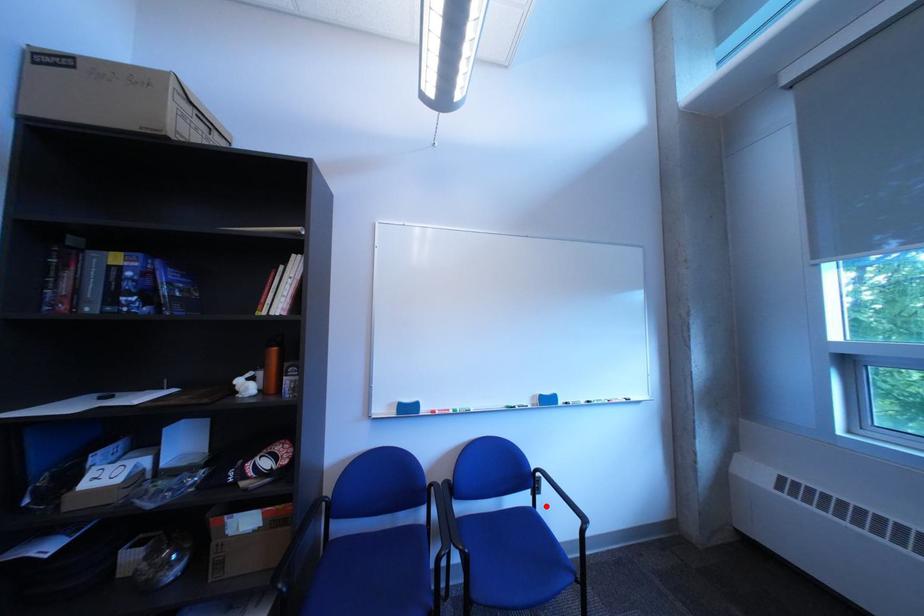
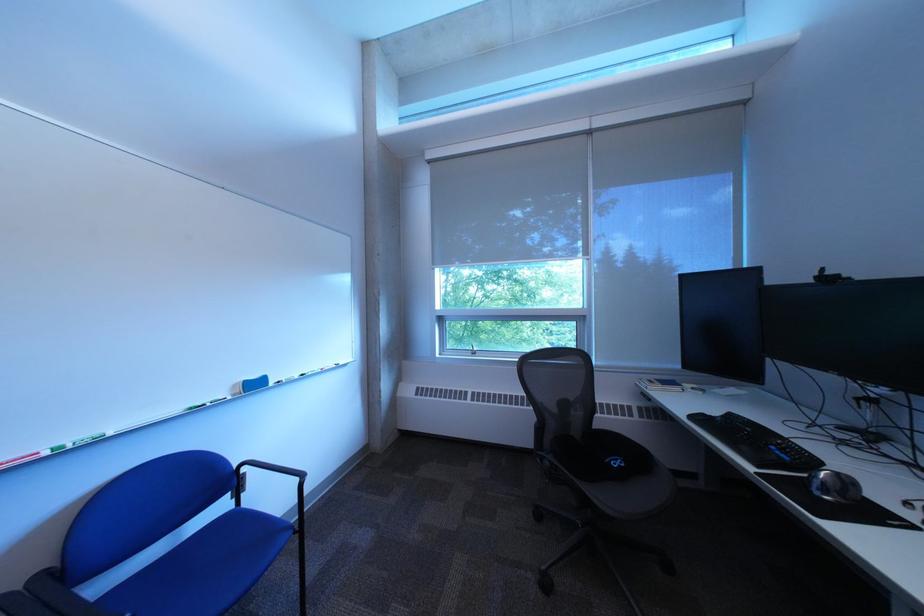
Question: A red point is marked in image1. In image2, is the corresponding 3D point closer to the camera or farther? Reply with the corresponding letter.

Choices:
 (A) The corresponding 3D point is closer.
 (B) The corresponding 3D point is farther.

Answer: (A)